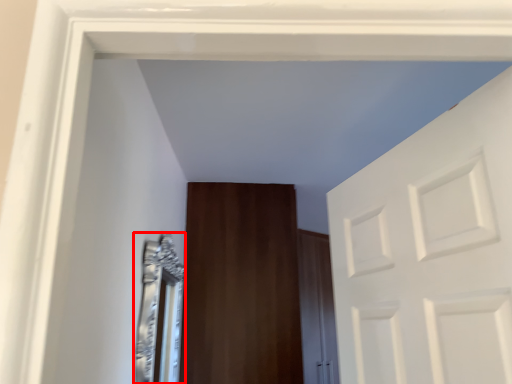
Question: In this image, where is mirror (annotated by the red box) located relative to door?

Choices:
 (A) right
 (B) left

Answer: (B)